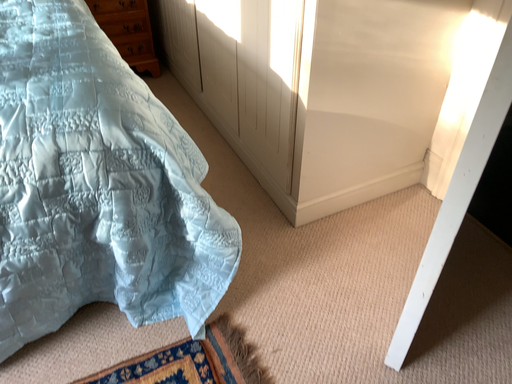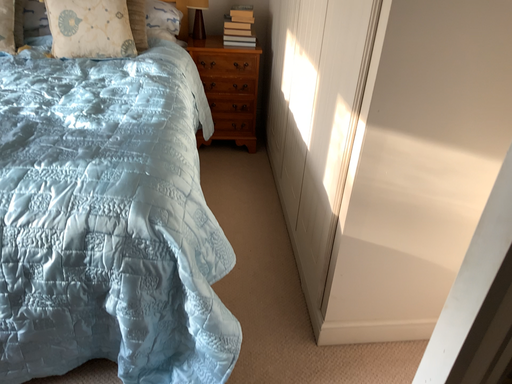
Question: How did the camera likely rotate when shooting the video?

Choices:
 (A) rotated downward
 (B) rotated upward

Answer: (B)